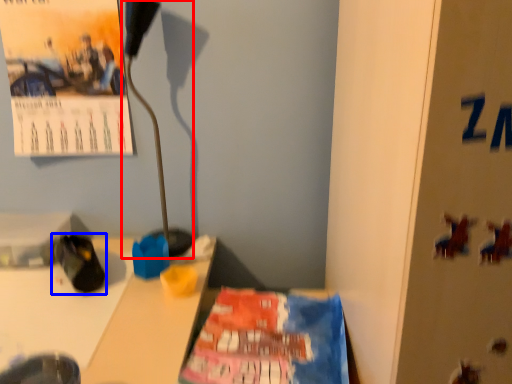
Question: Which object appears closest to the camera in this image, lamp (highlighted by a red box) or footwear (highlighted by a blue box)?

Choices:
 (A) lamp
 (B) footwear

Answer: (B)